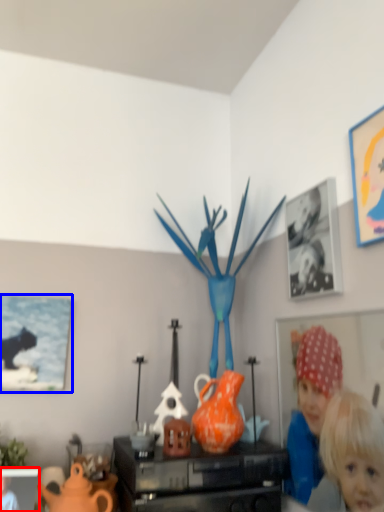
Question: Which of the following is the farthest to the observer, picture frame (highlighted by a red box) or picture frame (highlighted by a blue box)?

Choices:
 (A) picture frame
 (B) picture frame

Answer: (B)